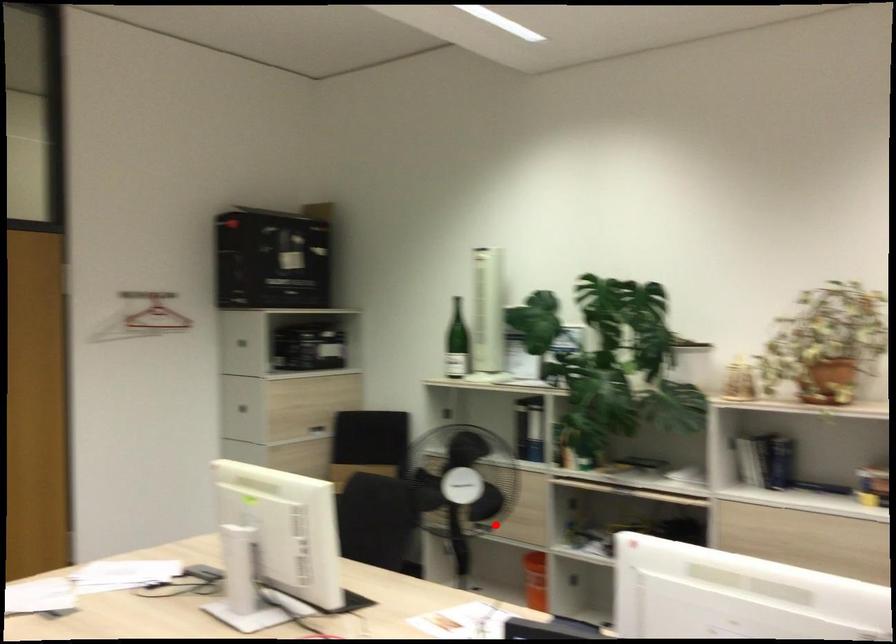
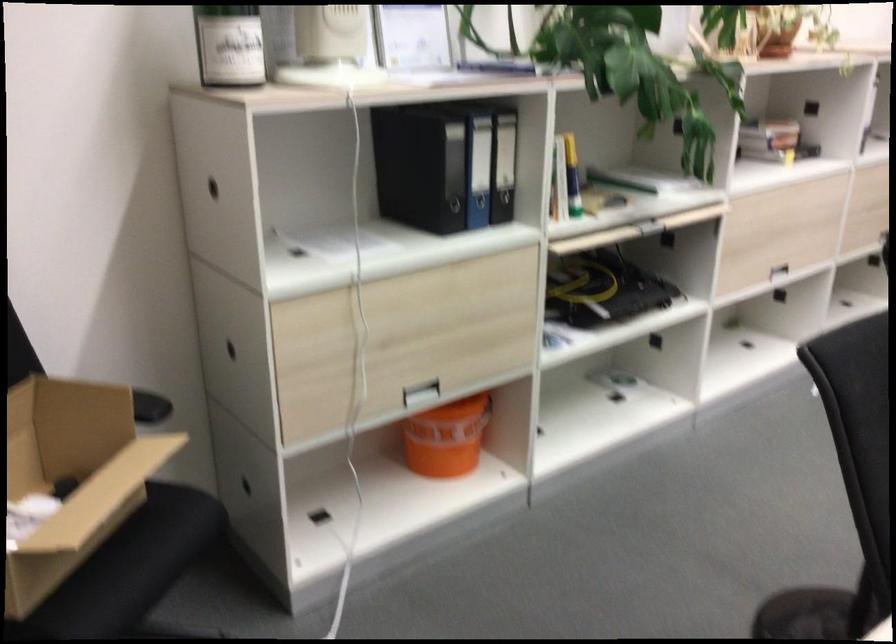
Question: I am providing you with two images of the same scene from different viewpoints. Given a red point in image1, look at the same physical point in image2. Is it:

Choices:
 (A) Closer to the viewpoint
 (B) Farther from the viewpoint

Answer: (A)